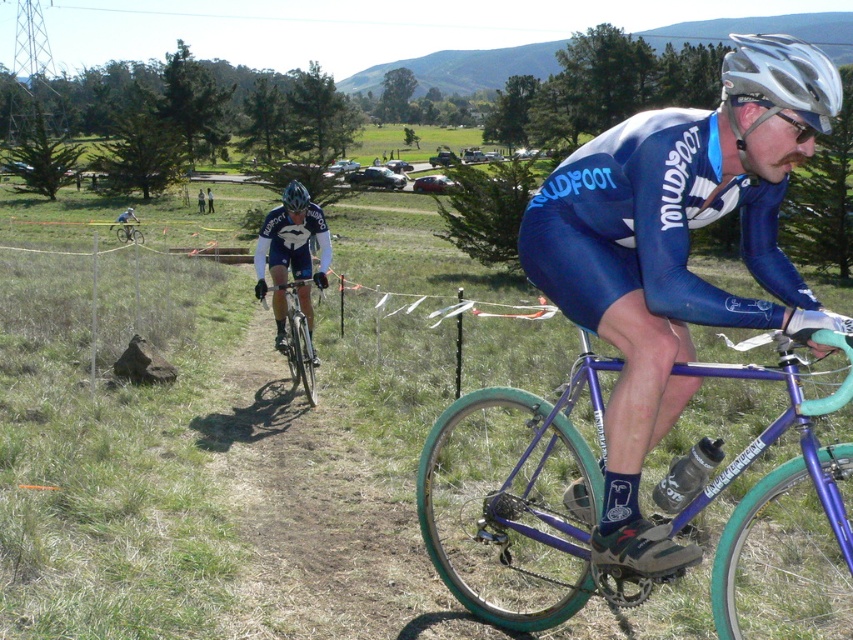
Which is more to the left, shiny silver bicycle at center or matte black helmet at center?

matte black helmet at center is more to the left.

Is shiny silver bicycle at center wider than matte black helmet at center?

Incorrect, shiny silver bicycle at center's width does not surpass matte black helmet at center's.

Is point (283, 323) positioned before point (286, 186)?

Yes, point (283, 323) is in front of point (286, 186).

You are a GUI agent. You are given a task and a screenshot of the screen. Output one action in this format:
    pyautogui.click(x=<x>, y=<y>)
    Task: Click on the shiny silver bicycle at center
    
    Given the screenshot: What is the action you would take?
    pyautogui.click(x=299, y=339)

Who is taller, blue/leather cycling suit at center or green matte bicycle at center?

blue/leather cycling suit at center

Who is more forward, (618, 326) or (142, 236)?

Point (618, 326)

I want to click on blue/leather cycling suit at center, so click(x=674, y=259).

The width and height of the screenshot is (853, 640). What do you see at coordinates (515, 500) in the screenshot?
I see `shiny purple bicycle at center` at bounding box center [515, 500].

Does shiny purple bicycle at center appear under shiny silver bicycle at center?

Yes.

What are the coordinates of `shiny purple bicycle at center` in the screenshot? It's located at (515, 500).